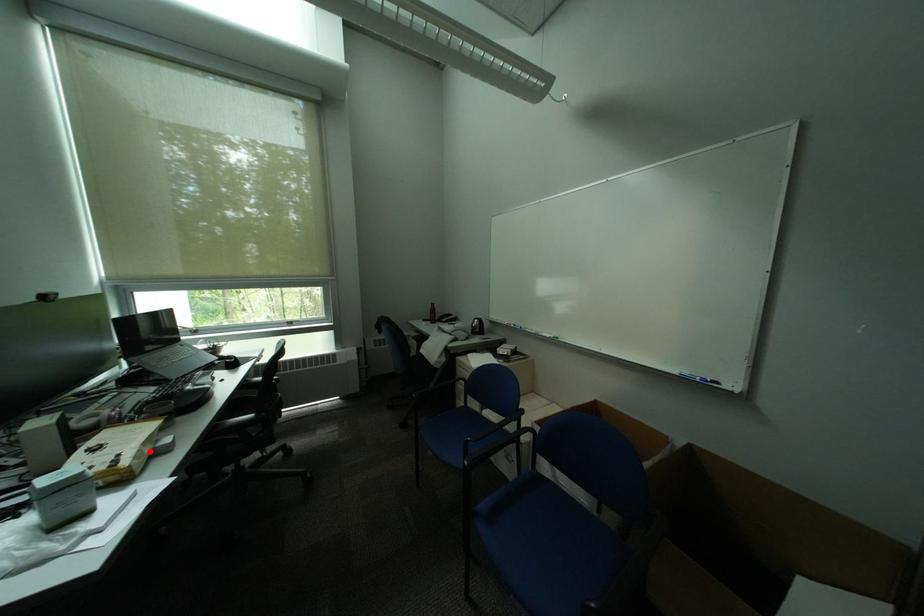
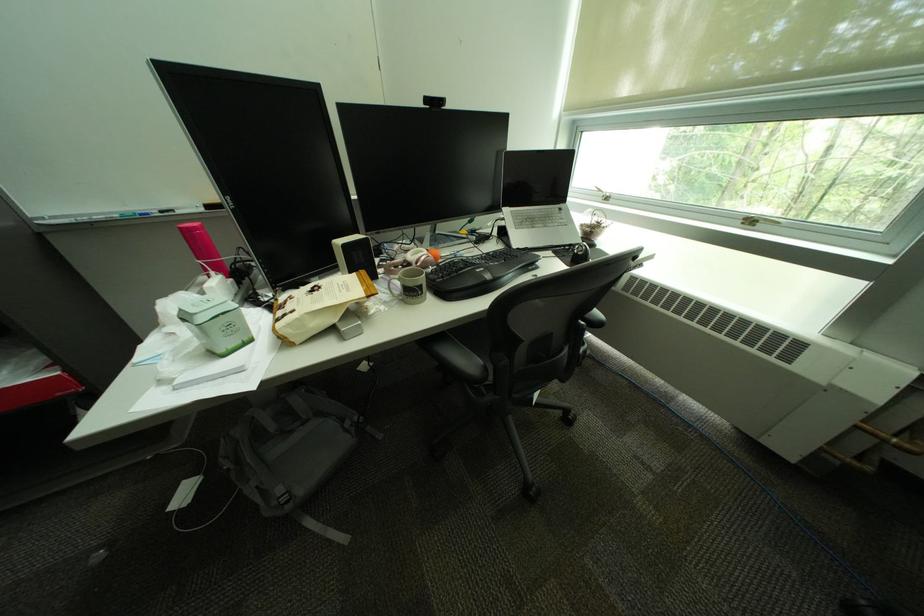
Where in the second image is the point corresponding to the highlighted location from the first image?

(309, 321)